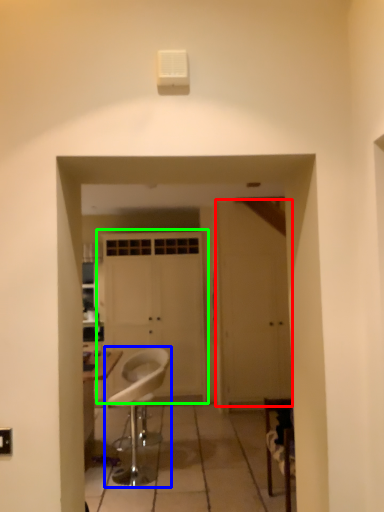
Question: Which object is the closest to the door (highlighted by a red box)? Choose among these: chair (highlighted by a blue box) or door (highlighted by a green box).

Choices:
 (A) chair
 (B) door

Answer: (B)